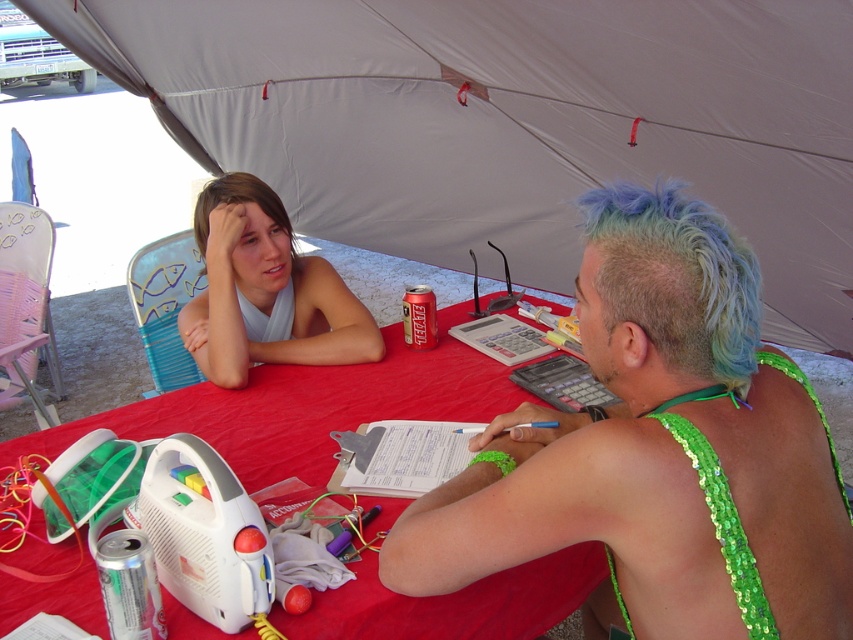
Question: Which is nearer to the blonde hair at upper left?

Choices:
 (A) blue dyed hair at upper right
 (B) red matte can at center
 (C) red fabric table at center
 (D) green sequined bikini top at center

Answer: (B)

Question: Which point is closer to the camera taking this photo?

Choices:
 (A) (193, 227)
 (B) (68, 548)

Answer: (B)

Question: Can you confirm if white fabric tent at upper center is smaller than blonde hair at upper left?

Choices:
 (A) no
 (B) yes

Answer: (A)

Question: Which object is farther from the camera taking this photo?

Choices:
 (A) green sequined bikini top at center
 (B) red fabric table at center

Answer: (B)

Question: Is white fabric tent at upper center above white fabric at center?

Choices:
 (A) no
 (B) yes

Answer: (B)

Question: Considering the relative positions of red fabric table at center and red matte can at center in the image provided, where is red fabric table at center located with respect to red matte can at center?

Choices:
 (A) above
 (B) below

Answer: (B)